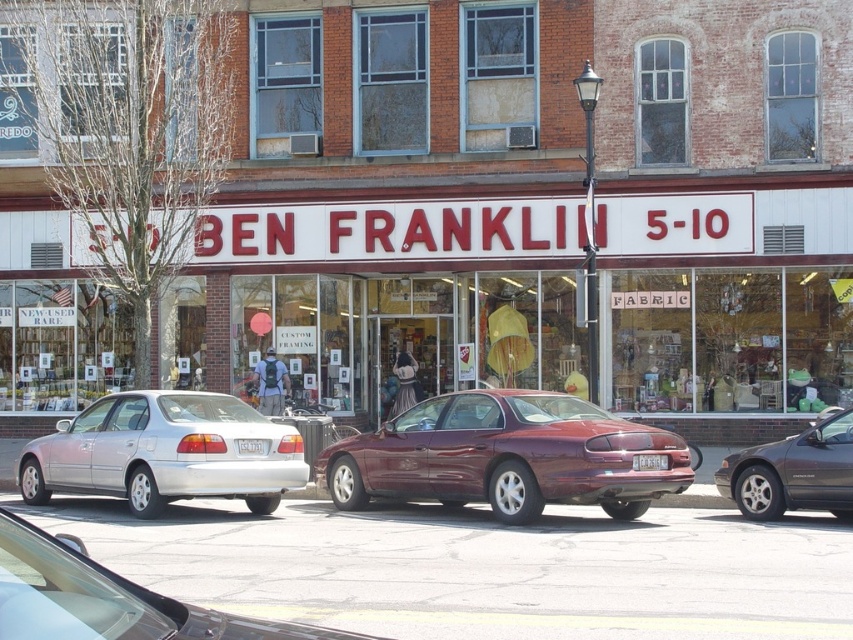
Who is higher up, matte white sign at center or maroon metallic sedan at center?

Positioned higher is matte white sign at center.

Between matte white sign at center and maroon metallic sedan at center, which one is positioned lower?

maroon metallic sedan at center is below.

Between point (758, 268) and point (509, 433), which one is positioned in front?

Point (509, 433)

This screenshot has width=853, height=640. I want to click on matte white sign at center, so click(x=381, y=296).

How far apart are maroon metallic sedan at center and silver metallic sedan at center?

The distance of maroon metallic sedan at center from silver metallic sedan at center is 29.02 feet.

Can you confirm if maroon metallic sedan at center is bigger than silver metallic sedan at center?

Correct, maroon metallic sedan at center is larger in size than silver metallic sedan at center.

The image size is (853, 640). In order to click on maroon metallic sedan at center in this screenshot , I will do `click(508, 456)`.

Does maroon metallic sedan at center appear over silver metallic sedan at left?

Indeed, maroon metallic sedan at center is positioned over silver metallic sedan at left.

Is maroon metallic sedan at center smaller than silver metallic sedan at left?

Incorrect, maroon metallic sedan at center is not smaller in size than silver metallic sedan at left.

Does point (544, 464) come in front of point (260, 419)?

Yes, it is in front of point (260, 419).

Image resolution: width=853 pixels, height=640 pixels. Identify the location of maroon metallic sedan at center. (508, 456).